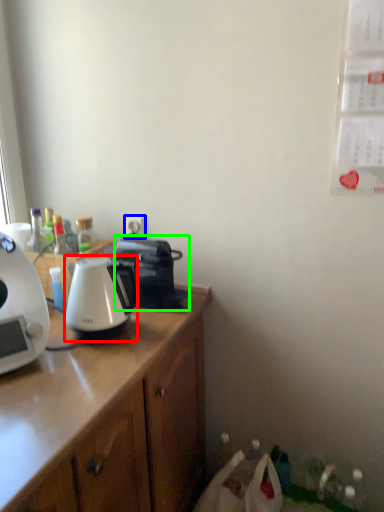
Question: Estimate the real-world distances between objects in this image. Which object is farther from kettle (highlighted by a red box), power outlet (highlighted by a blue box) or coffee maker (highlighted by a green box)?

Choices:
 (A) power outlet
 (B) coffee maker

Answer: (A)